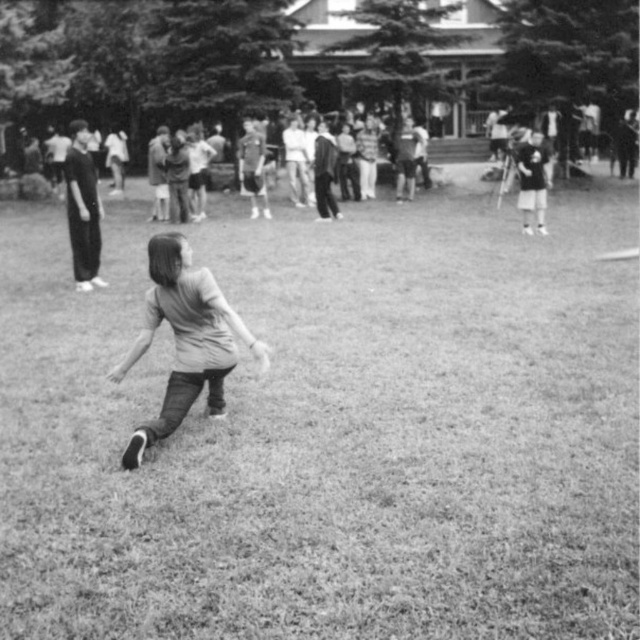
Between point (72, 182) and point (154, 141), which one is positioned in front?

Positioned in front is point (72, 182).

Locate an element on the screen. dark gray pants at left is located at coordinates (83, 209).

Is smooth gray shirt at center shorter than smooth leather jacket at upper center?

Yes, smooth gray shirt at center is shorter than smooth leather jacket at upper center.

Is point (188, 400) positioned before point (156, 180)?

Yes.

In the scene shown: Who is more forward, (192, 321) or (160, 145)?

Positioned in front is point (192, 321).

Identify the location of smooth gray shirt at center. (184, 339).

Which is more to the right, smooth gray shirt at center or dark gray pants at left?

Positioned to the right is smooth gray shirt at center.

Does point (205, 362) come behind point (74, 161)?

No.

This screenshot has height=640, width=640. I want to click on smooth gray shirt at center, so click(x=184, y=339).